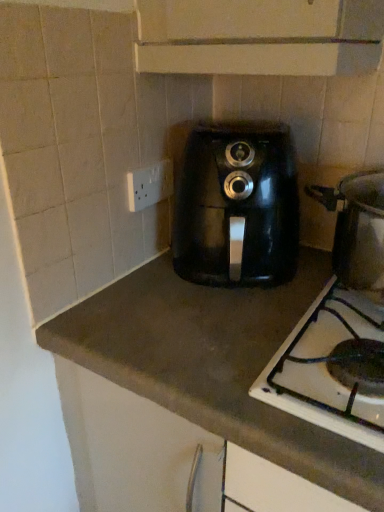
Identify the location of free space above brown matte countertop at center (from a real-world perspective). The height and width of the screenshot is (512, 384). (188, 306).